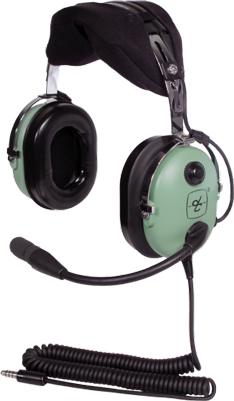
This screenshot has width=234, height=401. What are the coordinates of `head cushion` in the screenshot? It's located at (87, 31).